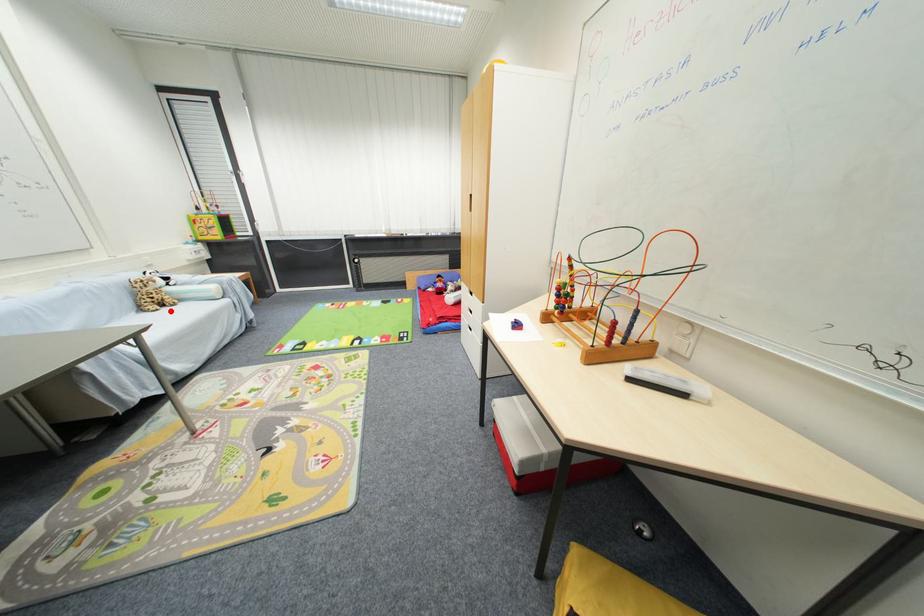
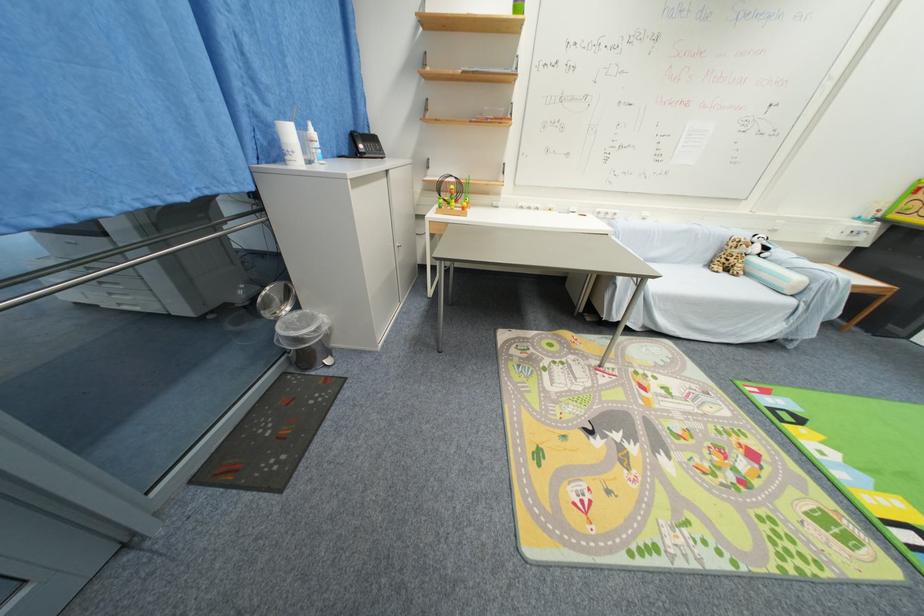
Find the pixel in the second image that matches the highlighted location in the first image.

(730, 276)